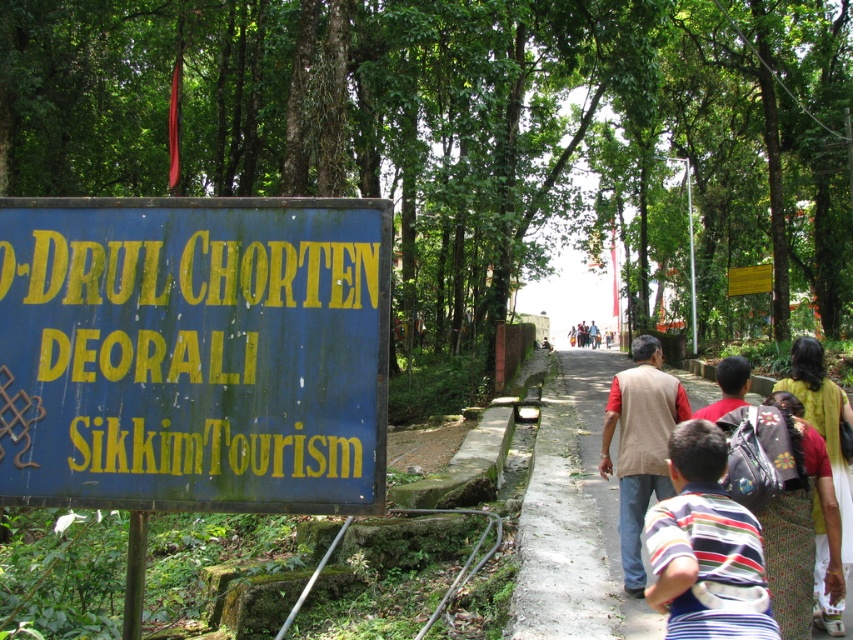
Question: Is concrete at center positioned in front of yellow cotton saree at right?

Choices:
 (A) yes
 (B) no

Answer: (B)

Question: Estimate the real-world distances between objects in this image. Which object is closer to the blue painted signboard at left?

Choices:
 (A) striped fabric shirt at lower right
 (B) light blue shirt at center
 (C) beige cotton vest at center

Answer: (A)

Question: Which of the following is the farthest from the observer?

Choices:
 (A) (711, 536)
 (B) (825, 566)
 (C) (590, 328)
 (D) (613, 481)

Answer: (C)

Question: Is striped fabric shirt at lower right positioned at the back of beige cotton vest at center?

Choices:
 (A) no
 (B) yes

Answer: (A)

Question: Which point is closer to the camera?

Choices:
 (A) (792, 368)
 (B) (96, 291)
 (C) (671, 520)
 (D) (590, 328)

Answer: (B)

Question: Observing the image, what is the correct spatial positioning of blue painted signboard at left in reference to yellow cotton saree at right?

Choices:
 (A) below
 (B) above

Answer: (B)